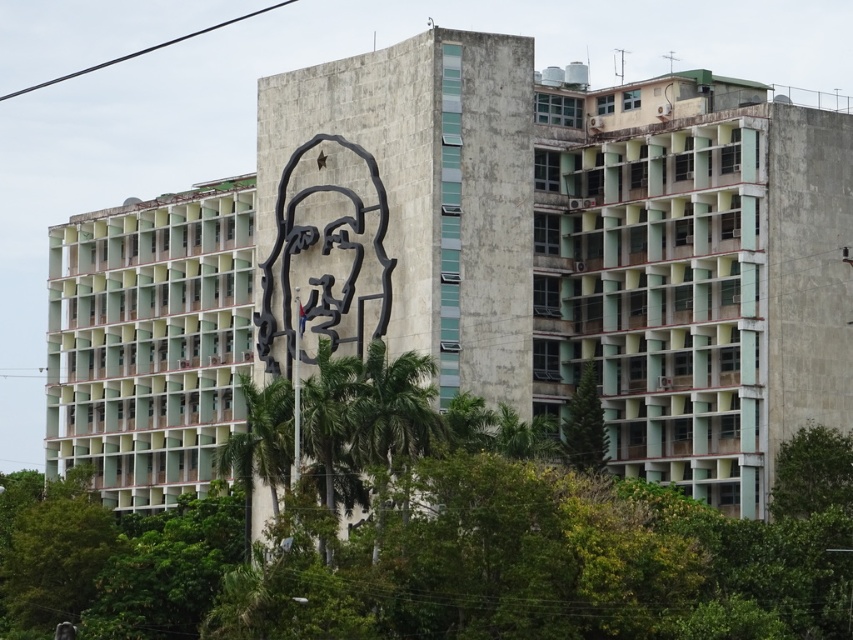
Does green leafy tree at center have a lesser width compared to green leafy tree at center-right?

No.

Does green leafy tree at center appear on the right side of green leafy tree at center-right?

In fact, green leafy tree at center is to the left of green leafy tree at center-right.

The image size is (853, 640). Describe the element at coordinates (432, 541) in the screenshot. I see `green leafy tree at center` at that location.

You are a GUI agent. You are given a task and a screenshot of the screen. Output one action in this format:
    pyautogui.click(x=<x>, y=<y>)
    Task: Click on the green leafy tree at center
    
    Given the screenshot: What is the action you would take?
    pyautogui.click(x=432, y=541)